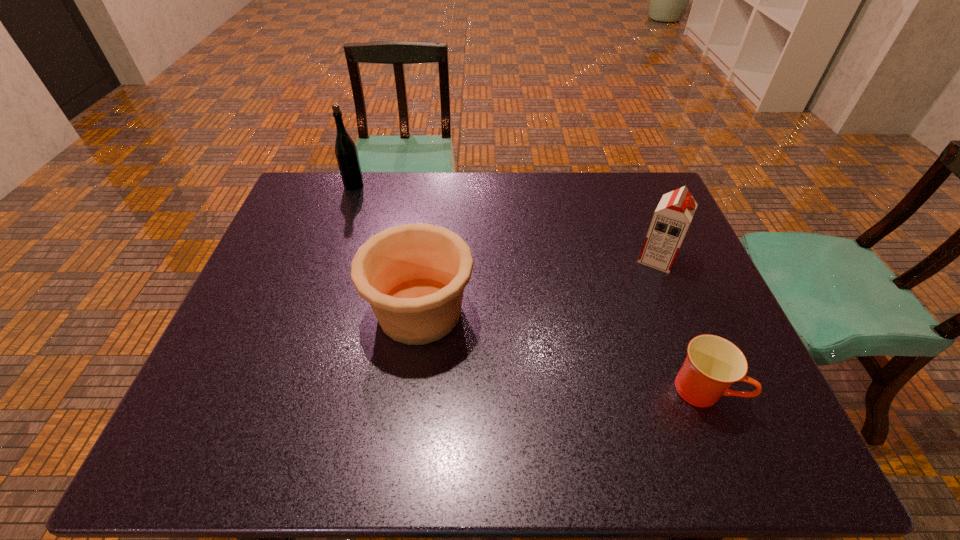
Identify which object is located as the second nearest to the nearest object. Please provide its 2D coordinates. Your answer should be formatted as a tuple, i.e. [(x, y)], where the tuple contains the x and y coordinates of a point satisfying the conditions above.

[(413, 275)]

This screenshot has width=960, height=540. I want to click on object that is the nearest to the second shortest object, so click(346, 152).

This screenshot has width=960, height=540. I want to click on vacant space that satisfies the following two spatial constraints: 1. on the front side of the third tallest object; 2. on the right side of the tallest object, so click(x=310, y=312).

Where is `free space in the image that satisfies the following two spatial constraints: 1. on the front side of the nearest object; 2. on the left side of the beer bottle`? free space in the image that satisfies the following two spatial constraints: 1. on the front side of the nearest object; 2. on the left side of the beer bottle is located at coordinates (283, 389).